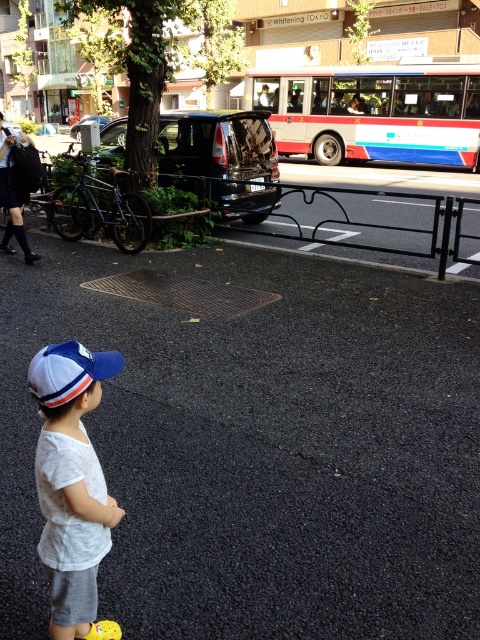
Question: Which of the following is the farthest from the observer?

Choices:
 (A) white and blue painted bus at center
 (B) white matte baseball cap at lower left
 (C) white cotton shirt at lower left

Answer: (A)

Question: Which object is positioned closest to the white matte baseball cap at lower left?

Choices:
 (A) white cotton shirt at lower left
 (B) white and blue painted bus at center

Answer: (A)

Question: Among these objects, which one is farthest from the camera?

Choices:
 (A) white matte baseball cap at lower left
 (B) white cotton shirt at lower left
 (C) white and blue painted bus at center

Answer: (C)

Question: Is white cotton shirt at lower left above white matte baseball cap at lower left?

Choices:
 (A) no
 (B) yes

Answer: (A)

Question: Is white and blue painted bus at center to the right of white matte baseball cap at lower left from the viewer's perspective?

Choices:
 (A) yes
 (B) no

Answer: (A)

Question: Does white cotton shirt at lower left have a larger size compared to white matte baseball cap at lower left?

Choices:
 (A) no
 (B) yes

Answer: (B)